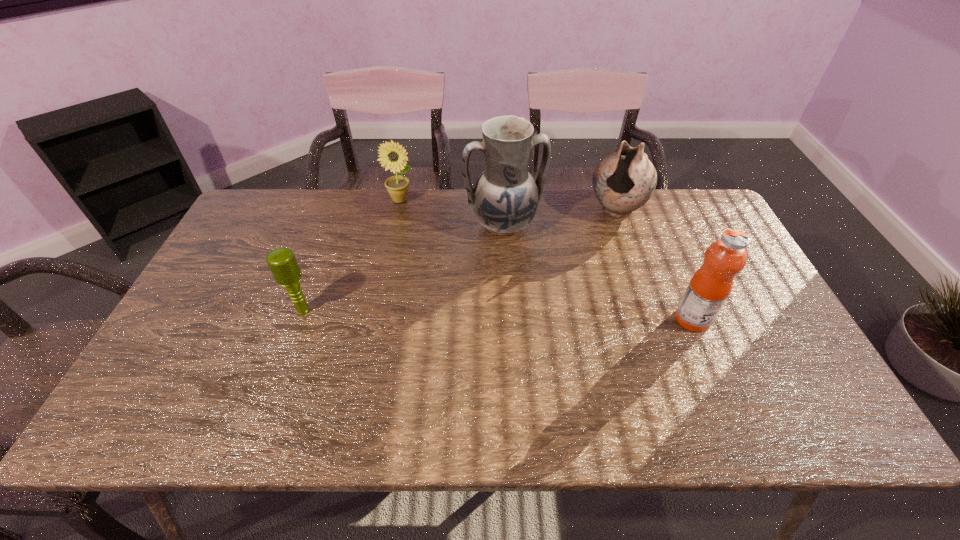
You are a GUI agent. You are given a task and a screenshot of the screen. Output one action in this format:
    pyautogui.click(x=<x>, y=<y>)
    Task: Click on the leftmost object
    
    Given the screenshot: What is the action you would take?
    pyautogui.click(x=282, y=263)

Where is `fruit juice`? This screenshot has height=540, width=960. fruit juice is located at coordinates (710, 286).

In order to click on the third object from right to left in this screenshot , I will do `click(505, 198)`.

Locate an element on the screen. pitcher is located at coordinates (505, 198).

Where is `sunflower`? The height and width of the screenshot is (540, 960). sunflower is located at coordinates (392, 156).

Where is `pottery`? pottery is located at coordinates (624, 181).

You are a GUI agent. You are given a task and a screenshot of the screen. Output one action in this format:
    pyautogui.click(x=<x>, y=<y>)
    Task: Click on the vacant space located on the right of the microphone
    
    Given the screenshot: What is the action you would take?
    464,311

Where is `free space located 0.170m on the front label of the fruit juice`? This screenshot has height=540, width=960. free space located 0.170m on the front label of the fruit juice is located at coordinates (776, 319).

You are a GUI agent. You are given a task and a screenshot of the screen. Output one action in this format:
    pyautogui.click(x=<x>, y=<y>)
    Task: Click on the vacant space located 0.170m on the front-facing side of the tallest object
    
    Given the screenshot: What is the action you would take?
    pyautogui.click(x=531, y=285)

The width and height of the screenshot is (960, 540). I want to click on free location located on the front-facing side of the tallest object, so click(539, 303).